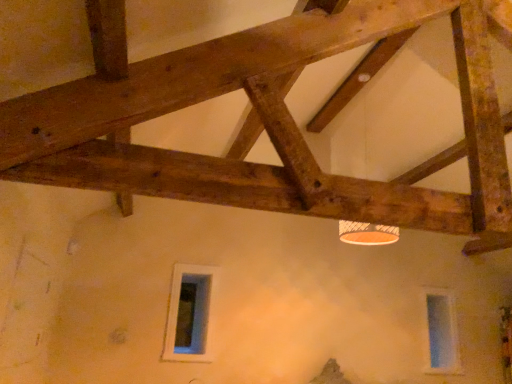
Measure the distance between orange matte lamp at upper center and camera.

orange matte lamp at upper center and camera are 2.67 meters apart from each other.

This screenshot has height=384, width=512. What do you see at coordinates (189, 314) in the screenshot? I see `white glass window at lower center, arranged as the 1th window when viewed from the front` at bounding box center [189, 314].

Image resolution: width=512 pixels, height=384 pixels. Identify the location of orange matte lamp at upper center. (367, 233).

From a real-world perspective, which is physically below, orange matte lamp at upper center or transparent glass window at lower right, arranged as the second window when viewed from the front?

transparent glass window at lower right, arranged as the second window when viewed from the front, from a real-world perspective.

At what (x,y) coordinates should I click in order to perform the action: click on lamp on the left of transparent glass window at lower right, acting as the 1th window starting from the back. Please return your answer as a coordinate pair (x, y). This screenshot has height=384, width=512. Looking at the image, I should click on (367, 233).

How distant is orange matte lamp at upper center from transparent glass window at lower right, acting as the 1th window starting from the back?

A distance of 5.47 feet exists between orange matte lamp at upper center and transparent glass window at lower right, acting as the 1th window starting from the back.

Is the depth of orange matte lamp at upper center less than that of transparent glass window at lower right, acting as the 1th window starting from the back?

Yes.

Which object is further away from the camera taking this photo, white glass window at lower center, which ranks as the first window in left-to-right order, or orange matte lamp at upper center?

white glass window at lower center, which ranks as the first window in left-to-right order.

How different are the orientations of white glass window at lower center, arranged as the 1th window when viewed from the front, and orange matte lamp at upper center in degrees?

They differ by 1.42 degrees in their facing directions.

Between white glass window at lower center, the 2th window in the back-to-front sequence, and orange matte lamp at upper center, which one appears on the right side from the viewer's perspective?

orange matte lamp at upper center is more to the right.

Is there a large distance between transparent glass window at lower right, the 2th window viewed from the left, and white glass window at lower center, which is the 2th window in right-to-left order?

That's right, there is a large distance between transparent glass window at lower right, the 2th window viewed from the left, and white glass window at lower center, which is the 2th window in right-to-left order.

Where is `window that appears above the transparent glass window at lower right, arranged as the second window when viewed from the front (from a real-world perspective)`? The height and width of the screenshot is (384, 512). window that appears above the transparent glass window at lower right, arranged as the second window when viewed from the front (from a real-world perspective) is located at coordinates (189, 314).

From the image's perspective, relative to white glass window at lower center, which is the 2th window in right-to-left order, is transparent glass window at lower right, acting as the 1th window starting from the back, above or below?

transparent glass window at lower right, acting as the 1th window starting from the back, is below white glass window at lower center, which is the 2th window in right-to-left order.

Is orange matte lamp at upper center positioned with its back to white glass window at lower center, arranged as the 1th window when viewed from the front?

No, white glass window at lower center, arranged as the 1th window when viewed from the front, is not at the back of orange matte lamp at upper center.

Are orange matte lamp at upper center and white glass window at lower center, which is the 2th window in right-to-left order, located far from each other?

Yes.

The width and height of the screenshot is (512, 384). I want to click on window that is the 1st one when counting backward from the orange matte lamp at upper center, so click(x=189, y=314).

Can we say orange matte lamp at upper center lies outside white glass window at lower center, arranged as the 1th window when viewed from the front?

orange matte lamp at upper center lies outside white glass window at lower center, arranged as the 1th window when viewed from the front,'s area.

Considering the sizes of objects white glass window at lower center, which is the 2th window in right-to-left order, and transparent glass window at lower right, arranged as the second window when viewed from the front, in the image provided, who is bigger, white glass window at lower center, which is the 2th window in right-to-left order, or transparent glass window at lower right, arranged as the second window when viewed from the front,?

Bigger between the two is transparent glass window at lower right, arranged as the second window when viewed from the front.

Does point (201, 299) appear closer or farther from the camera than point (432, 361)?

Point (201, 299) appears to be closer to the viewer than point (432, 361).

Based on the photo, can you confirm if white glass window at lower center, the 2th window in the back-to-front sequence, is shorter than transparent glass window at lower right, the 2th window viewed from the left?

Correct, white glass window at lower center, the 2th window in the back-to-front sequence, is not as tall as transparent glass window at lower right, the 2th window viewed from the left.

How many degrees apart are the facing directions of white glass window at lower center, which ranks as the first window in left-to-right order, and transparent glass window at lower right, acting as the 1th window starting from the back?

The facing directions of white glass window at lower center, which ranks as the first window in left-to-right order, and transparent glass window at lower right, acting as the 1th window starting from the back, are 0.0237 degrees apart.

How many degrees apart are the facing directions of transparent glass window at lower right, the 2th window viewed from the left, and orange matte lamp at upper center?

1.42 degrees separate the facing orientations of transparent glass window at lower right, the 2th window viewed from the left, and orange matte lamp at upper center.

Does transparent glass window at lower right, acting as the 1th window starting from the back, have a greater width compared to orange matte lamp at upper center?

No, transparent glass window at lower right, acting as the 1th window starting from the back, is not wider than orange matte lamp at upper center.

Can you confirm if transparent glass window at lower right, the 2th window viewed from the left, is positioned to the right of orange matte lamp at upper center?

Indeed, transparent glass window at lower right, the 2th window viewed from the left, is positioned on the right side of orange matte lamp at upper center.

Can we say transparent glass window at lower right, acting as the first window starting from the right, lies outside orange matte lamp at upper center?

transparent glass window at lower right, acting as the first window starting from the right, lies outside orange matte lamp at upper center's area.

Identify the location of window on the right of orange matte lamp at upper center. The image size is (512, 384). (441, 333).

This screenshot has height=384, width=512. Identify the location of lamp located above the white glass window at lower center, arranged as the 1th window when viewed from the front (from a real-world perspective). (367, 233).

Based on the photo, when comparing their distances from transparent glass window at lower right, acting as the 1th window starting from the back, does orange matte lamp at upper center or white glass window at lower center, which ranks as the first window in left-to-right order, seem further?

white glass window at lower center, which ranks as the first window in left-to-right order.

Estimate the real-world distances between objects in this image. Which object is closer to orange matte lamp at upper center, transparent glass window at lower right, arranged as the second window when viewed from the front, or white glass window at lower center, which is the 2th window in right-to-left order?

The object closer to orange matte lamp at upper center is white glass window at lower center, which is the 2th window in right-to-left order.

From the image, which object appears to be farther from orange matte lamp at upper center, white glass window at lower center, arranged as the 1th window when viewed from the front, or transparent glass window at lower right, acting as the 1th window starting from the back?

The object further to orange matte lamp at upper center is transparent glass window at lower right, acting as the 1th window starting from the back.

Considering their positions, is transparent glass window at lower right, acting as the 1th window starting from the back, positioned further to white glass window at lower center, the 2th window in the back-to-front sequence, than orange matte lamp at upper center?

transparent glass window at lower right, acting as the 1th window starting from the back, lies further to white glass window at lower center, the 2th window in the back-to-front sequence, than the other object.

Considering their positions, is orange matte lamp at upper center positioned closer to white glass window at lower center, the 2th window in the back-to-front sequence, than transparent glass window at lower right, acting as the 1th window starting from the back?

orange matte lamp at upper center.

When comparing their distances from transparent glass window at lower right, acting as the 1th window starting from the back, does white glass window at lower center, which is the 2th window in right-to-left order, or orange matte lamp at upper center seem further?

white glass window at lower center, which is the 2th window in right-to-left order.

Image resolution: width=512 pixels, height=384 pixels. I want to click on lamp located between white glass window at lower center, which ranks as the first window in left-to-right order, and transparent glass window at lower right, arranged as the second window when viewed from the front, in the left-right direction, so click(x=367, y=233).